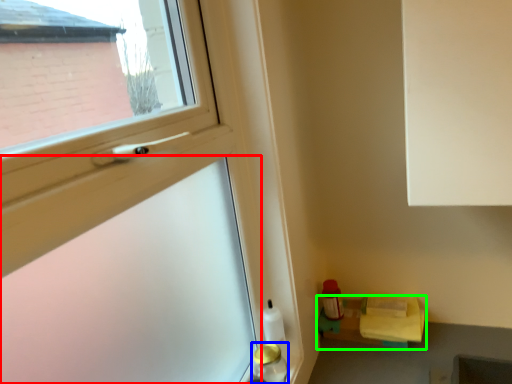
Question: Based on their relative distances, which object is farther from screen door (highlighted by a red box)? Choose from bottle (highlighted by a blue box) and shelf (highlighted by a green box).

Choices:
 (A) bottle
 (B) shelf

Answer: (B)